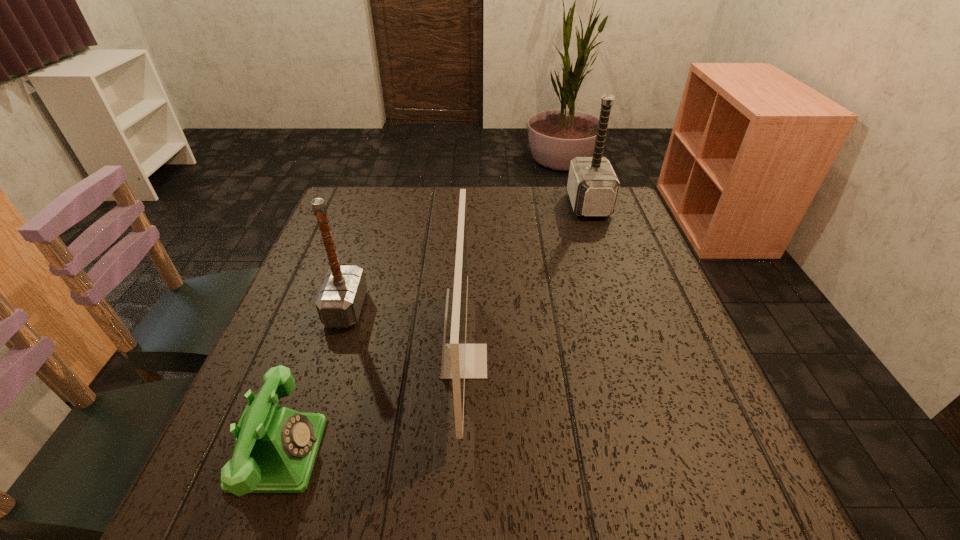
Find the location of `vacant area that lies between the shortest object and the farther hammer`. vacant area that lies between the shortest object and the farther hammer is located at coordinates (434, 328).

This screenshot has height=540, width=960. Find the location of `free point between the telephone and the monitor`. free point between the telephone and the monitor is located at coordinates (372, 407).

In order to click on unoccupied area between the monitor and the telephone in this screenshot , I will do `click(372, 407)`.

What are the coordinates of `free spot between the left hammer and the right hammer` in the screenshot? It's located at (468, 256).

What are the coordinates of `the third closest object to the right hammer` in the screenshot? It's located at (275, 448).

Select which object is the closest to the third object from left to right. Please provide its 2D coordinates. Your answer should be formatted as a tuple, i.e. [(x, y)], where the tuple contains the x and y coordinates of a point satisfying the conditions above.

[(339, 302)]